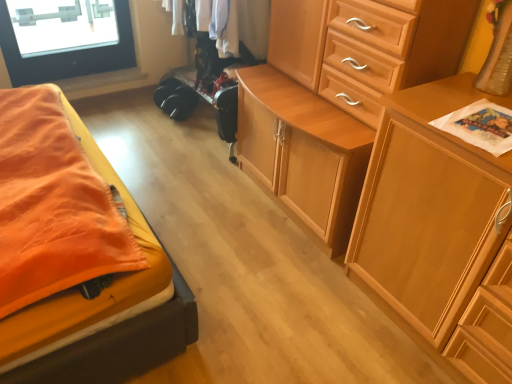
Question: In which direction should I rotate to look at wooden cabinet at center, which appears as the first chest of drawers when viewed from the right?

Choices:
 (A) right
 (B) left

Answer: (A)

Question: Could you tell me if black fabric clothing at center is turned towards wooden cabinet at center, positioned as the 2th chest of drawers in right-to-left order?

Choices:
 (A) no
 (B) yes

Answer: (A)

Question: Is black fabric clothing at center next to wooden cabinet at center, positioned as the 2th chest of drawers in right-to-left order, and touching it?

Choices:
 (A) yes
 (B) no

Answer: (B)

Question: Considering the relative positions of black fabric clothing at center and wooden cabinet at center, positioned as the 2th chest of drawers in right-to-left order, in the image provided, is black fabric clothing at center behind wooden cabinet at center, positioned as the 2th chest of drawers in right-to-left order,?

Choices:
 (A) no
 (B) yes

Answer: (B)

Question: Is black fabric clothing at center in front of wooden cabinet at center, positioned as the 2th chest of drawers in right-to-left order?

Choices:
 (A) yes
 (B) no

Answer: (B)

Question: Does black fabric clothing at center have a lesser width compared to wooden cabinet at center, positioned as the 2th chest of drawers in right-to-left order?

Choices:
 (A) yes
 (B) no

Answer: (A)

Question: Considering the relative sizes of black fabric clothing at center and wooden cabinet at center, acting as the 1th chest of drawers starting from the left, in the image provided, is black fabric clothing at center taller than wooden cabinet at center, acting as the 1th chest of drawers starting from the left,?

Choices:
 (A) no
 (B) yes

Answer: (A)

Question: Is wooden cabinet at center, arranged as the 2th chest of drawers when viewed from the left, closer to camera compared to wooden cabinet at center, acting as the 1th chest of drawers starting from the left?

Choices:
 (A) no
 (B) yes

Answer: (B)

Question: From a real-world perspective, is wooden cabinet at center, which appears as the first chest of drawers when viewed from the right, under wooden cabinet at center, acting as the 1th chest of drawers starting from the left?

Choices:
 (A) yes
 (B) no

Answer: (A)

Question: Is wooden cabinet at center, arranged as the 2th chest of drawers when viewed from the left, not inside wooden cabinet at center, acting as the 1th chest of drawers starting from the left?

Choices:
 (A) no
 (B) yes

Answer: (B)

Question: Does wooden cabinet at center, which appears as the first chest of drawers when viewed from the right, have a smaller size compared to wooden cabinet at center, positioned as the 2th chest of drawers in right-to-left order?

Choices:
 (A) yes
 (B) no

Answer: (A)

Question: Considering the relative sizes of wooden cabinet at center, arranged as the 2th chest of drawers when viewed from the left, and wooden cabinet at center, positioned as the 2th chest of drawers in right-to-left order, in the image provided, is wooden cabinet at center, arranged as the 2th chest of drawers when viewed from the left, thinner than wooden cabinet at center, positioned as the 2th chest of drawers in right-to-left order,?

Choices:
 (A) no
 (B) yes

Answer: (B)

Question: Is wooden cabinet at center, which appears as the first chest of drawers when viewed from the right, aimed at wooden cabinet at center, acting as the 1th chest of drawers starting from the left?

Choices:
 (A) yes
 (B) no

Answer: (B)

Question: Can you confirm if black fabric clothing at center is taller than wooden cabinet at center, which appears as the first chest of drawers when viewed from the right?

Choices:
 (A) yes
 (B) no

Answer: (B)